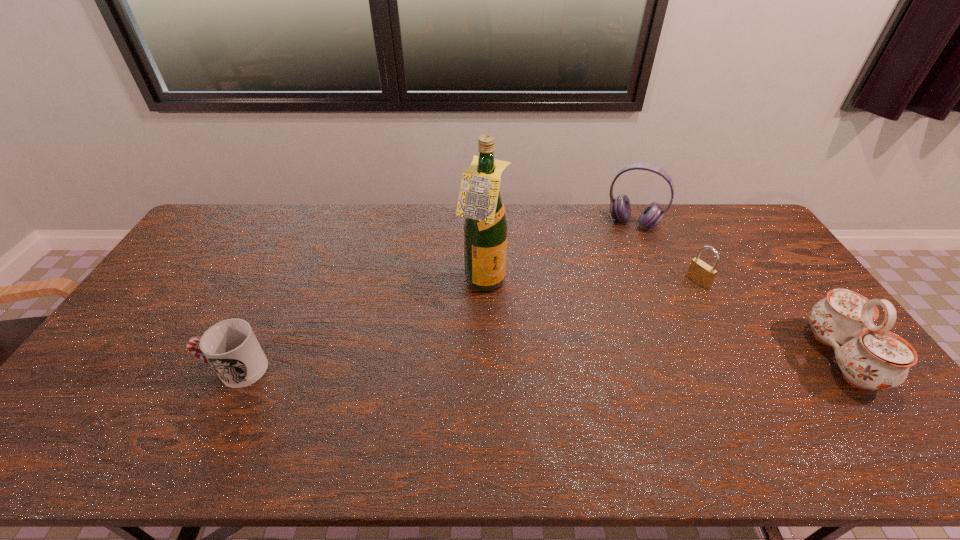
Where is `cup`? The height and width of the screenshot is (540, 960). cup is located at coordinates (230, 346).

This screenshot has width=960, height=540. Find the location of `the rightmost object`. the rightmost object is located at coordinates 871,357.

Find the location of a particular element. the farthest object is located at coordinates (620, 208).

Locate an element on the screen. The image size is (960, 540). padlock is located at coordinates (701, 273).

You are a GUI agent. You are given a task and a screenshot of the screen. Output one action in this format:
    pyautogui.click(x=<x>, y=<y>)
    Task: Click on the tallest object
    The height and width of the screenshot is (540, 960).
    Given the screenshot: What is the action you would take?
    pyautogui.click(x=485, y=226)

Where is `liquor`? Image resolution: width=960 pixels, height=540 pixels. liquor is located at coordinates (485, 226).

This screenshot has height=540, width=960. What are the coordinates of `vacant space located 0.290m on the side of the cup where the handle is located` in the screenshot? It's located at (94, 369).

This screenshot has width=960, height=540. I want to click on vacant area situated 0.090m on the side of the cup where the handle is located, so click(x=170, y=369).

In order to click on vacant space situated 0.160m on the side of the cup where the handle is located in this screenshot , I will do `click(143, 369)`.

Image resolution: width=960 pixels, height=540 pixels. What are the coordinates of `blank space located 0.210m by the handle of the rightmost object` in the screenshot? It's located at click(x=737, y=357).